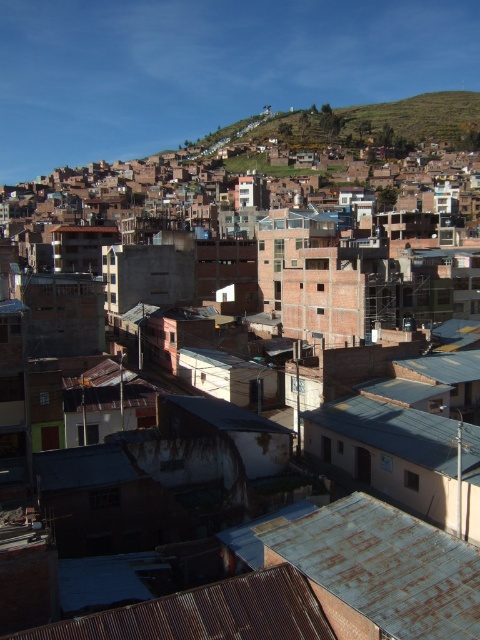
Between rusty corrugated metal roof at lower right and rusty metal roof at center, which one has less height?

Standing shorter between the two is rusty corrugated metal roof at lower right.

Is point (268, 536) positioned in front of point (325, 420)?

Yes, it is in front of point (325, 420).

This screenshot has height=640, width=480. I want to click on rusty corrugated metal roof at lower right, so click(381, 570).

Which of these two, rusty corrugated metal roof at lower center or rusty metal roof at center, stands taller?

rusty metal roof at center

Where is `rusty corrugated metal roof at lower center`? The image size is (480, 640). rusty corrugated metal roof at lower center is located at coordinates (207, 612).

Who is more distant from viewer, (120, 630) or (422, 422)?

Positioned behind is point (422, 422).

Locate an element on the screen. rusty corrugated metal roof at lower center is located at coordinates (207, 612).

Between rusty corrugated metal roof at lower right and rusty corrugated metal roof at lower center, which one appears on the left side from the viewer's perspective?

Positioned to the left is rusty corrugated metal roof at lower center.

Can you confirm if rusty corrugated metal roof at lower right is smaller than rusty corrugated metal roof at lower center?

Actually, rusty corrugated metal roof at lower right might be larger than rusty corrugated metal roof at lower center.

What are the coordinates of `rusty corrugated metal roof at lower right` in the screenshot? It's located at (381, 570).

Identify the location of rusty corrugated metal roof at lower right. The width and height of the screenshot is (480, 640). (381, 570).